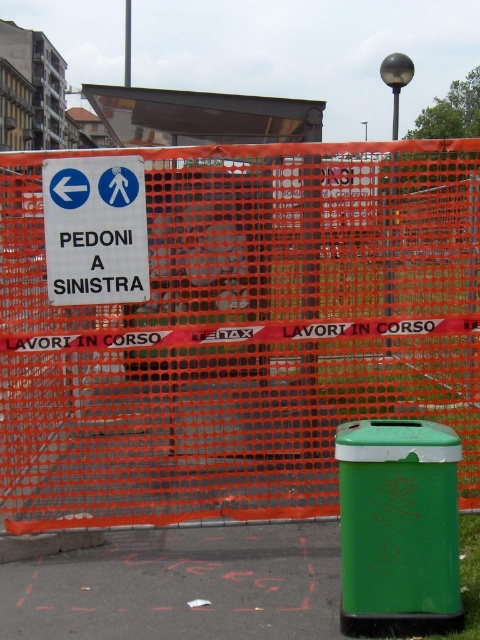
From the picture: You are a pedestrian trying to cross the construction site. You see the orange mesh fence at center and the green asphalt pavement at lower right. Which surface should you avoid stepping on?

The orange mesh fence at center is positioned over the green asphalt pavement at lower right, so you should avoid stepping on the orange mesh fence at center as it is likely part of the construction barrier and not meant for walking.